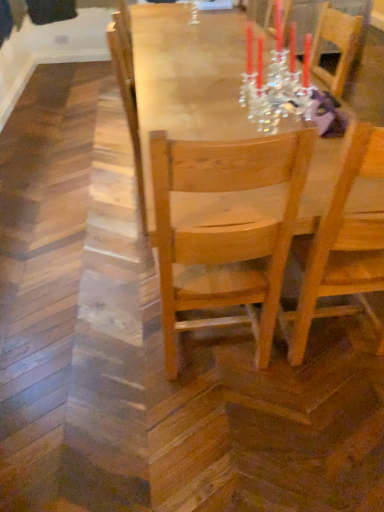
You are a GUI agent. You are given a task and a screenshot of the screen. Output one action in this format:
    pyautogui.click(x=<x>, y=<y>)
    Task: Click on the wooden chair at center, the second chair when ordered from left to right
    This screenshot has width=384, height=512.
    Given the screenshot: What is the action you would take?
    pyautogui.click(x=341, y=247)

At what (x,y) coordinates should I click in order to perform the action: click on light wood chair at center, positioned as the 1th chair in left-to-right order. Please return your answer as a coordinate pair (x, y). The width and height of the screenshot is (384, 512). Looking at the image, I should click on pos(225,233).

Locate an element on the screen. The image size is (384, 512). wooden chair at center, the first chair from the right is located at coordinates (341, 247).

From the image's perspective, which one is positioned lower, light wood chair at center, positioned as the 1th chair in left-to-right order, or wooden chair at center, the second chair when ordered from left to right?

light wood chair at center, positioned as the 1th chair in left-to-right order, is shown below in the image.

Looking at their sizes, would you say light wood chair at center, the 2th chair positioned from the right, is wider or thinner than wooden chair at center, the second chair when ordered from left to right?

In the image, light wood chair at center, the 2th chair positioned from the right, appears to be more narrow than wooden chair at center, the second chair when ordered from left to right.

Would you say light wood chair at center, the 2th chair positioned from the right, contains wooden chair at center, the second chair when ordered from left to right?

No.

How many degrees apart are the facing directions of light wood chair at center, positioned as the 1th chair in left-to-right order, and wooden chair at center, the second chair when ordered from left to right?

0.000106 degrees separate the facing orientations of light wood chair at center, positioned as the 1th chair in left-to-right order, and wooden chair at center, the second chair when ordered from left to right.

Considering the sizes of objects light wood chair at center, positioned as the 1th chair in left-to-right order, and wooden table at center in the image provided, who is smaller, light wood chair at center, positioned as the 1th chair in left-to-right order, or wooden table at center?

With smaller size is light wood chair at center, positioned as the 1th chair in left-to-right order.

Considering the relative positions of light wood chair at center, the 2th chair positioned from the right, and wooden table at center in the image provided, is light wood chair at center, the 2th chair positioned from the right, to the left or to the right of wooden table at center?

From the image, it's evident that light wood chair at center, the 2th chair positioned from the right, is to the left of wooden table at center.

From the image's perspective, is light wood chair at center, positioned as the 1th chair in left-to-right order, on wooden table at center?

No, from the image's perspective, light wood chair at center, positioned as the 1th chair in left-to-right order, is not over wooden table at center.

Can you tell me how much light wood chair at center, the 2th chair positioned from the right, and wooden table at center differ in facing direction?

The angular difference between light wood chair at center, the 2th chair positioned from the right, and wooden table at center is 91.9 degrees.

From a real-world perspective, is wooden table at center over wooden chair at center, the first chair from the right?

No.

Is wooden chair at center, the first chair from the right, located within wooden table at center?

That's correct, wooden chair at center, the first chair from the right, is inside wooden table at center.

Between wooden table at center and wooden chair at center, the first chair from the right, which one has smaller size?

wooden chair at center, the first chair from the right, is smaller.

Consider the image. Between wooden table at center and wooden chair at center, the second chair when ordered from left to right, which one appears on the left side from the viewer's perspective?

Positioned to the left is wooden table at center.

Considering the sizes of objects wooden table at center and light wood chair at center, the 2th chair positioned from the right, in the image provided, who is thinner, wooden table at center or light wood chair at center, the 2th chair positioned from the right,?

light wood chair at center, the 2th chair positioned from the right.

Is wooden table at center not near light wood chair at center, the 2th chair positioned from the right?

wooden table at center is actually quite close to light wood chair at center, the 2th chair positioned from the right.

Considering the relative positions of wooden table at center and light wood chair at center, the 2th chair positioned from the right, in the image provided, is wooden table at center to the left or to the right of light wood chair at center, the 2th chair positioned from the right,?

Clearly, wooden table at center is on the right of light wood chair at center, the 2th chair positioned from the right, in the image.

Could you tell me if wooden chair at center, the second chair when ordered from left to right, is facing wooden table at center?

Yes, wooden chair at center, the second chair when ordered from left to right, is aimed at wooden table at center.

In the scene shown: Does wooden chair at center, the first chair from the right, appear on the left side of wooden table at center?

No, wooden chair at center, the first chair from the right, is not to the left of wooden table at center.

Relative to wooden table at center, is wooden chair at center, the first chair from the right, in front or behind?

Clearly, wooden chair at center, the first chair from the right, is in front of wooden table at center.

Which is less distant, (x=314, y=288) or (x=235, y=229)?

Clearly, point (x=314, y=288) is more distant from the camera than point (x=235, y=229).

Could you tell me if wooden chair at center, the first chair from the right, is turned towards light wood chair at center, the 2th chair positioned from the right?

No.

From the image's perspective, does wooden chair at center, the second chair when ordered from left to right, appear higher than light wood chair at center, positioned as the 1th chair in left-to-right order?

Correct, wooden chair at center, the second chair when ordered from left to right, appears higher than light wood chair at center, positioned as the 1th chair in left-to-right order, in the image.

Is wooden chair at center, the second chair when ordered from left to right, not inside light wood chair at center, positioned as the 1th chair in left-to-right order?

Yes, wooden chair at center, the second chair when ordered from left to right, is located beyond the bounds of light wood chair at center, positioned as the 1th chair in left-to-right order.

Find the location of `chair that appears above the light wood chair at center, the 2th chair positioned from the right (from the image's perspective)`. chair that appears above the light wood chair at center, the 2th chair positioned from the right (from the image's perspective) is located at coordinates (341, 247).

This screenshot has height=512, width=384. Find the location of `table on the right of light wood chair at center, positioned as the 1th chair in left-to-right order`. table on the right of light wood chair at center, positioned as the 1th chair in left-to-right order is located at coordinates (192, 125).

Based on their spatial positions, is wooden chair at center, the second chair when ordered from left to right, or light wood chair at center, positioned as the 1th chair in left-to-right order, closer to wooden table at center?

Among the two, light wood chair at center, positioned as the 1th chair in left-to-right order, is located nearer to wooden table at center.

Looking at this image, which object lies nearer to the anchor point light wood chair at center, positioned as the 1th chair in left-to-right order, wooden table at center or wooden chair at center, the first chair from the right?

wooden chair at center, the first chair from the right, lies closer to light wood chair at center, positioned as the 1th chair in left-to-right order, than the other object.

When comparing their distances from wooden table at center, does light wood chair at center, the 2th chair positioned from the right, or wooden chair at center, the first chair from the right, seem further?

Based on the image, wooden chair at center, the first chair from the right, appears to be further to wooden table at center.

When comparing their distances from light wood chair at center, positioned as the 1th chair in left-to-right order, does wooden chair at center, the second chair when ordered from left to right, or wooden table at center seem further?

Among the two, wooden table at center is located further to light wood chair at center, positioned as the 1th chair in left-to-right order.

Based on their spatial positions, is wooden table at center or light wood chair at center, positioned as the 1th chair in left-to-right order, further from wooden chair at center, the second chair when ordered from left to right?

The object further to wooden chair at center, the second chair when ordered from left to right, is wooden table at center.

When comparing their distances from wooden chair at center, the first chair from the right, does light wood chair at center, positioned as the 1th chair in left-to-right order, or wooden table at center seem further?

Among the two, wooden table at center is located further to wooden chair at center, the first chair from the right.

Image resolution: width=384 pixels, height=512 pixels. I want to click on chair that lies between wooden table at center and light wood chair at center, positioned as the 1th chair in left-to-right order, from top to bottom, so click(x=341, y=247).